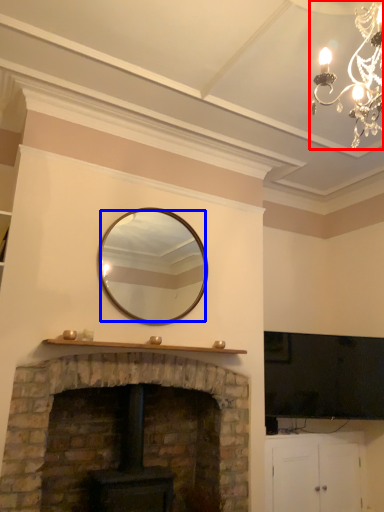
Question: Which object appears closest to the camera in this image, lamp (highlighted by a red box) or mirror (highlighted by a blue box)?

Choices:
 (A) lamp
 (B) mirror

Answer: (A)